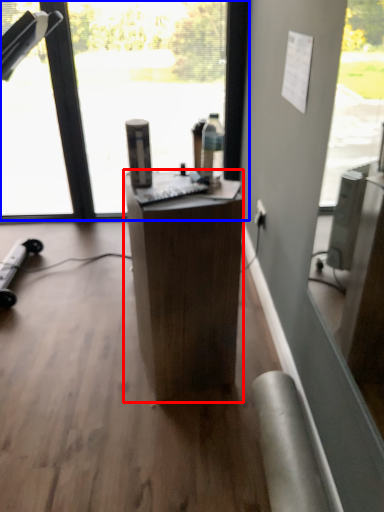
Question: Among these objects, which one is farthest to the camera, desk (highlighted by a red box) or window (highlighted by a blue box)?

Choices:
 (A) desk
 (B) window

Answer: (B)